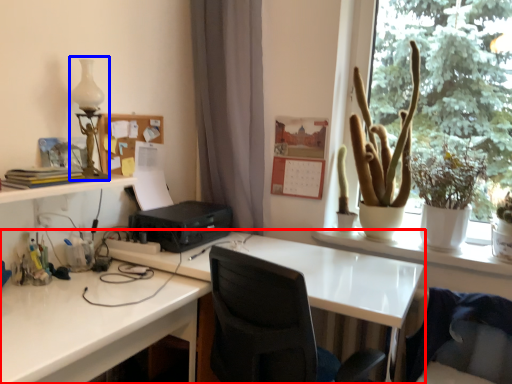
Question: Which object is further to the camera taking this photo, desk (highlighted by a red box) or table lamp (highlighted by a blue box)?

Choices:
 (A) desk
 (B) table lamp

Answer: (B)